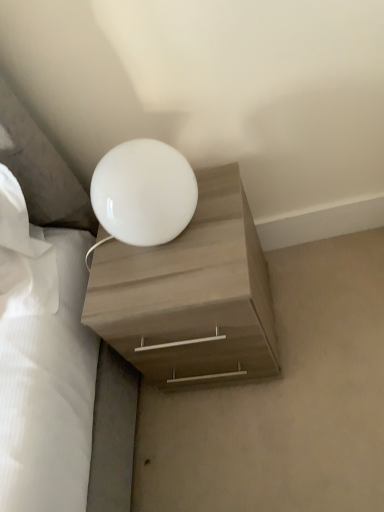
Question: Considering the positions of white glossy lamp at upper center and matte wood nightstand at center in the image, is white glossy lamp at upper center taller or shorter than matte wood nightstand at center?

Choices:
 (A) short
 (B) tall

Answer: (A)

Question: From a real-world perspective, is white glossy lamp at upper center above or below matte wood nightstand at center?

Choices:
 (A) above
 (B) below

Answer: (B)

Question: Estimate the real-world distances between objects in this image. Which object is closer to the white glossy sphere at upper center?

Choices:
 (A) white glossy lamp at upper center
 (B) matte wood nightstand at center

Answer: (B)

Question: Considering the real-world distances, which object is farthest from the white glossy lamp at upper center?

Choices:
 (A) white glossy sphere at upper center
 (B) matte wood nightstand at center

Answer: (A)